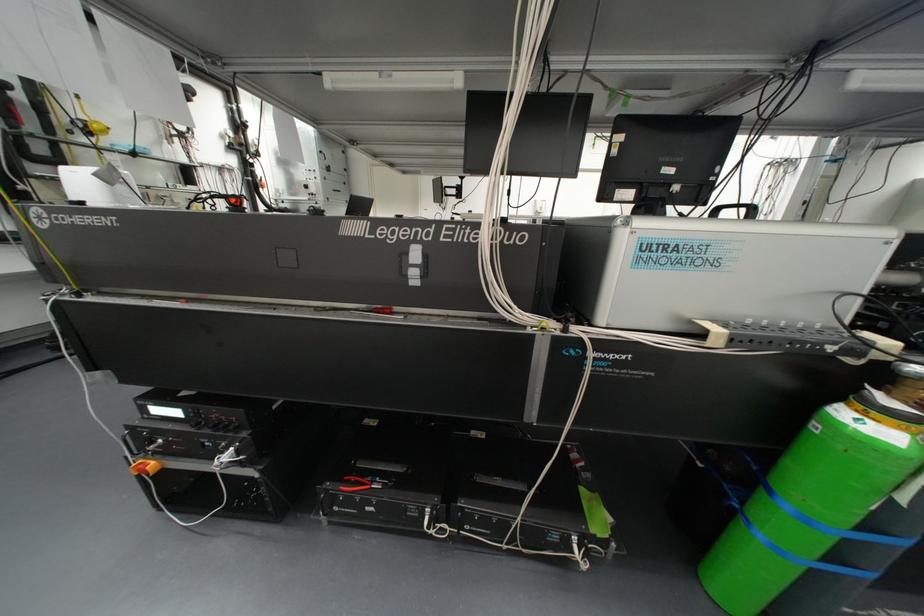
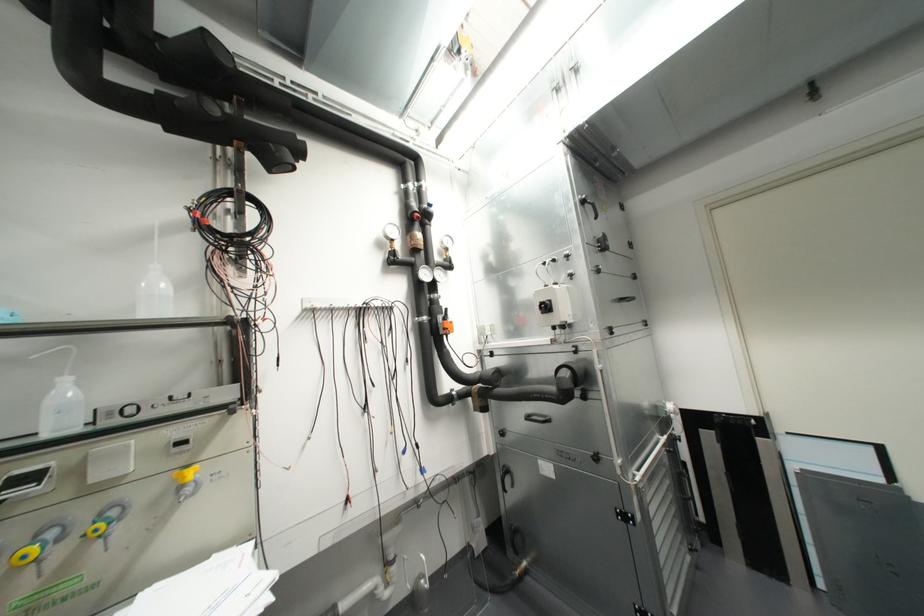
Find the pixel in the second image that matches (x=305, y=185) in the first image.

(545, 307)